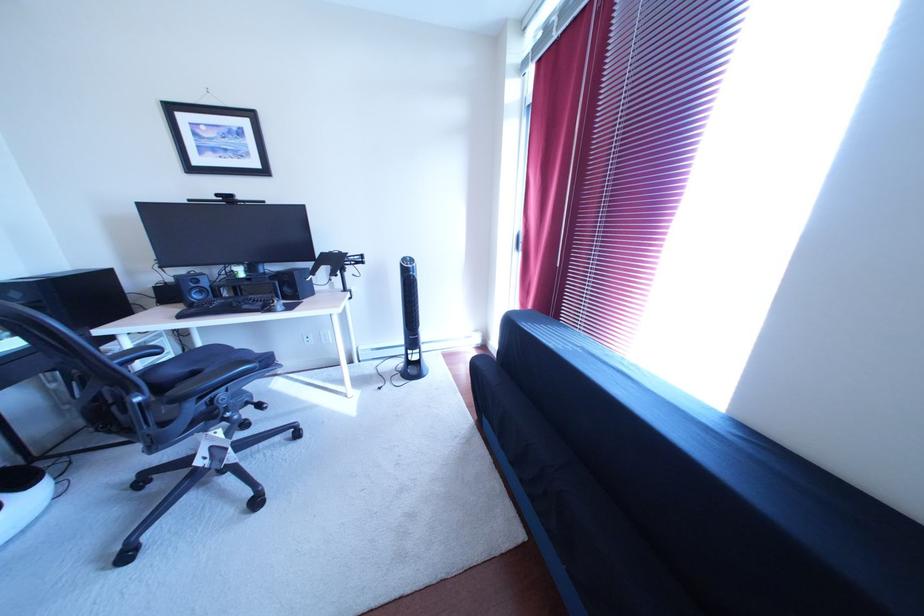
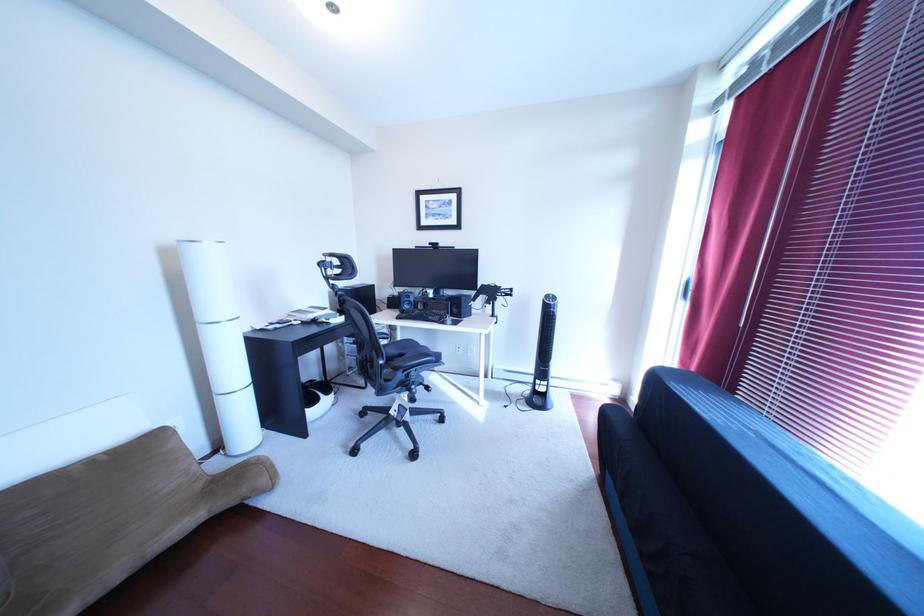
Question: The first image is from the beginning of the video and the second image is from the end. How did the camera likely rotate when shooting the video?

Choices:
 (A) Left
 (B) Right
 (C) Up
 (D) Down

Answer: (A)